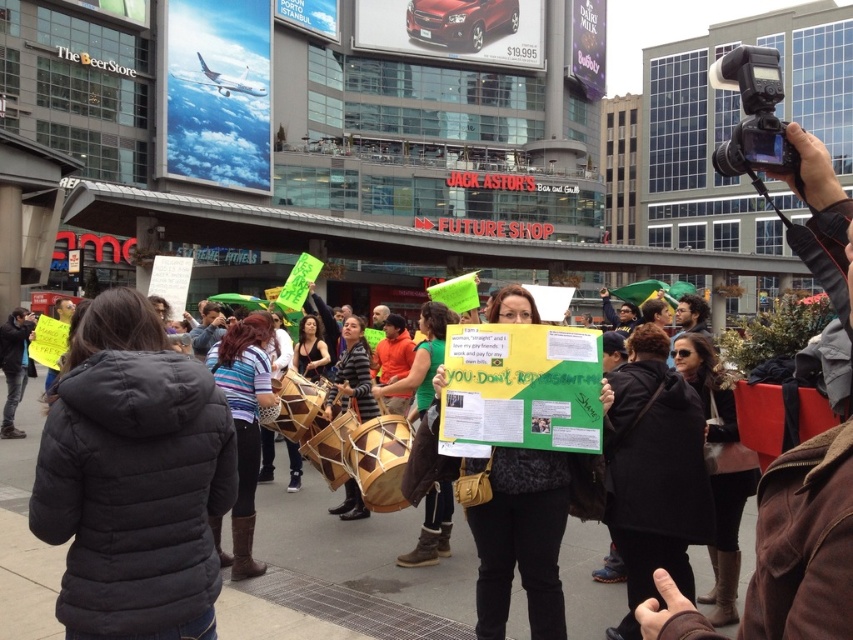
You are a photographer standing in the city square and want to take a photo of the green paper sign at center. The camera you are using has a focal length of 50mm and an aperture of f2.8. To ensure the sign is in focus, what is the minimum distance you should be from the sign based on the given coordinates?

The green paper sign at center is located at coordinates (521, 538) in the image. However, without knowing the actual physical dimensions of the scene or the distance from the camera to the sign, it is impossible to calculate the exact minimum distance required for the sign to be in focus using the provided information. The coordinates alone do not provide sufficient data for this calculation.